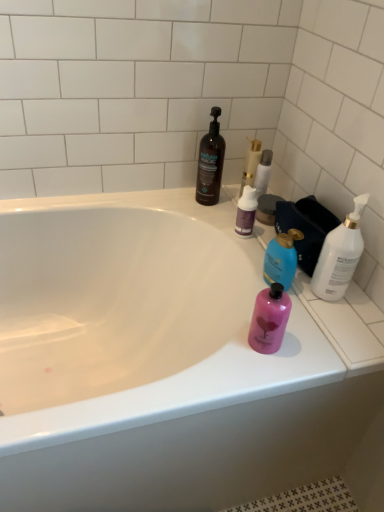
Locate an element on the screen. free area in between blue glossy bottle at upper right, the second bottle in the right-to-left sequence, and dark brown plastic bottle at upper center, arranged as the 5th bottle when viewed from the right is located at coordinates (230, 238).